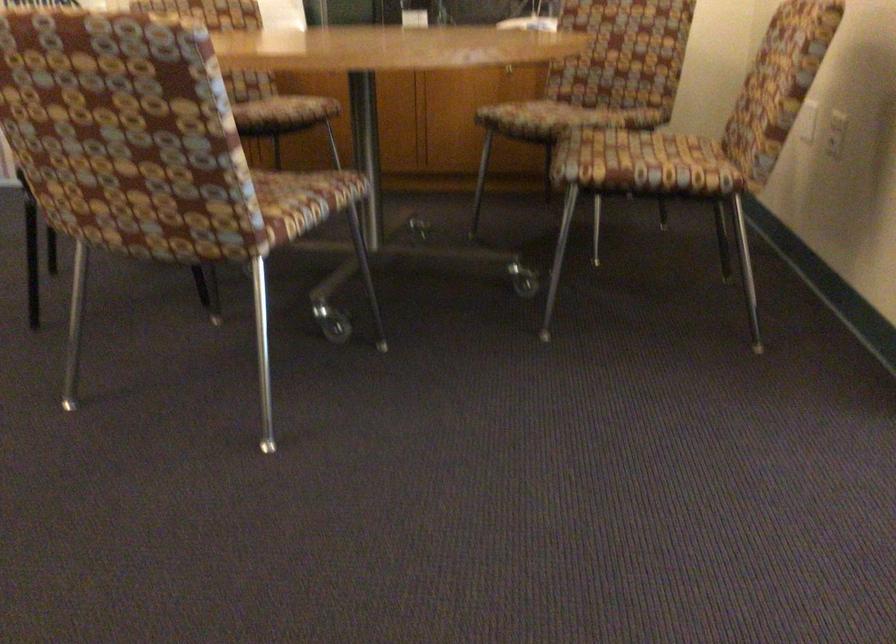
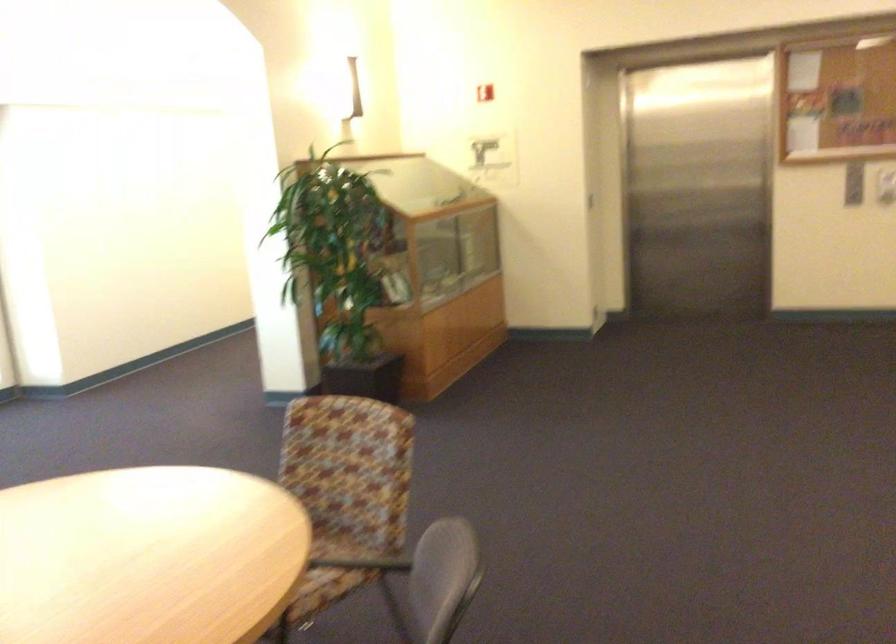
Question: I am providing you with two images of the same scene from different viewpoints. Please identify which objects are invisible in image2.

Choices:
 (A) chair sitting surface
 (B) grey chair sitting surface
 (C) phone button
 (D) patterned chair sitting surface

Answer: (A)